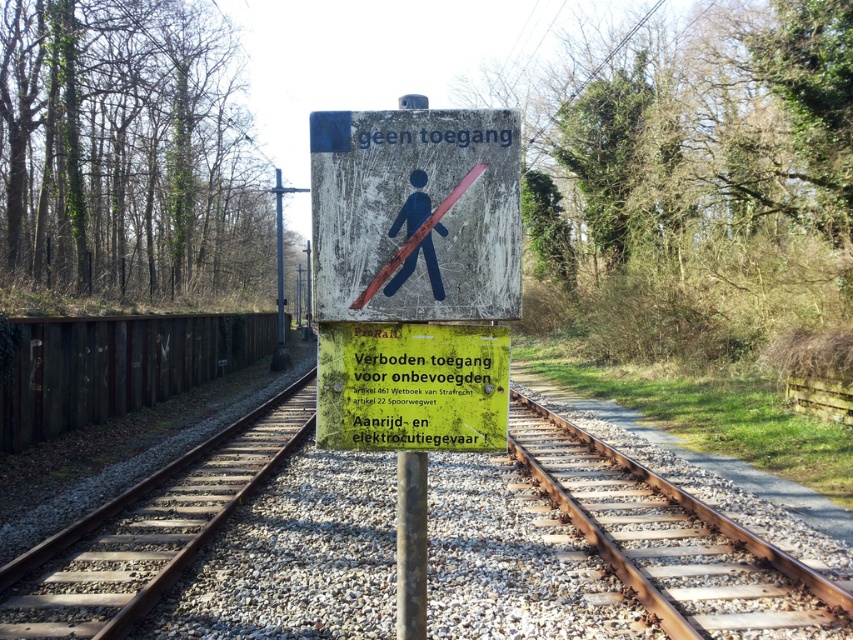
Which is below, gravel railway track at center or weathered wood sign at center?

gravel railway track at center

Is gravel railway track at center smaller than weathered wood sign at center?

Indeed, gravel railway track at center has a smaller size compared to weathered wood sign at center.

The height and width of the screenshot is (640, 853). Find the location of `gravel railway track at center`. gravel railway track at center is located at coordinates (x=294, y=557).

Does yellow-green plastic sign at center appear on the right side of rusty metal pole at center?

Indeed, yellow-green plastic sign at center is positioned on the right side of rusty metal pole at center.

Who is more forward, (437, 410) or (415, 472)?

Point (437, 410)

This screenshot has width=853, height=640. Identify the location of yellow-green plastic sign at center. (410, 387).

Is gravel railway track at center closer to the viewer compared to yellow-green plastic sign at center?

That is False.

Does gravel railway track at center have a greater width compared to yellow-green plastic sign at center?

Indeed, gravel railway track at center has a greater width compared to yellow-green plastic sign at center.

This screenshot has width=853, height=640. What do you see at coordinates (294, 557) in the screenshot?
I see `gravel railway track at center` at bounding box center [294, 557].

This screenshot has width=853, height=640. Identify the location of gravel railway track at center. (294, 557).